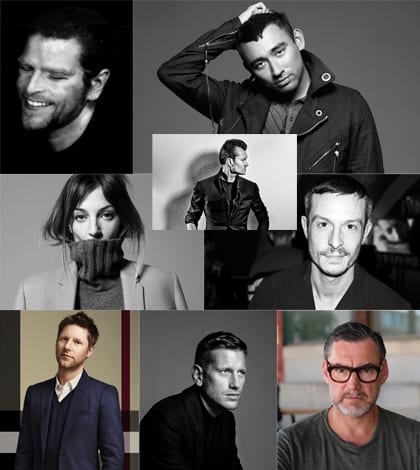
The image size is (420, 470). I want to click on photographs in collage, so click(x=5, y=316), click(x=145, y=316), click(x=281, y=314), click(x=301, y=180), click(x=158, y=139), click(x=4, y=177), click(x=3, y=4), click(x=137, y=5).